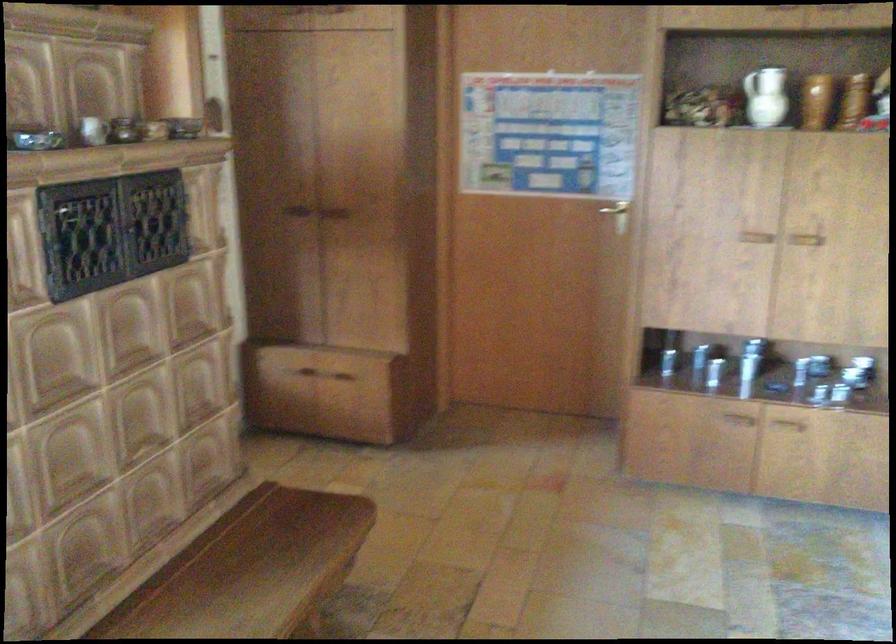
What do you see at coordinates (616, 214) in the screenshot?
I see `the gold door handle` at bounding box center [616, 214].